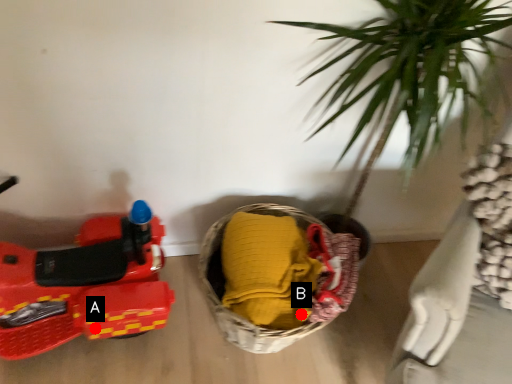
Question: Two points are circled on the image, labeled by A and B beside each circle. Which point is farther to the camera?

Choices:
 (A) A is further
 (B) B is further

Answer: (A)